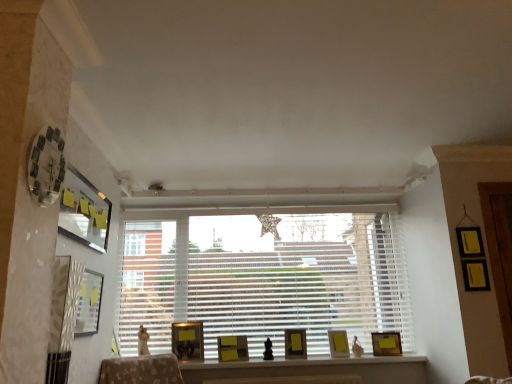
Question: Can we say matte wooden picture frame at center, which is counted as the 3th picture frame, starting from the left, lies outside matte yellow picture frame at center, placed as the 4th picture frame when sorted from front to back?

Choices:
 (A) yes
 (B) no

Answer: (A)

Question: Is matte wooden picture frame at center, arranged as the 3th picture frame when viewed from the front, at the left side of matte yellow picture frame at center, positioned as the fourth picture frame in left-to-right order?

Choices:
 (A) yes
 (B) no

Answer: (A)

Question: From the image's perspective, is matte wooden picture frame at center, arranged as the 3th picture frame when viewed from the front, on top of matte yellow picture frame at center, which is the fourth picture frame in back-to-front order?

Choices:
 (A) no
 (B) yes

Answer: (B)

Question: Does matte wooden picture frame at center, which is counted as the 5th picture frame, starting from the right, turn towards matte yellow picture frame at center, which is the fourth picture frame in back-to-front order?

Choices:
 (A) yes
 (B) no

Answer: (B)

Question: From a real-world perspective, is matte wooden picture frame at center, which is counted as the 3th picture frame, starting from the left, physically below matte yellow picture frame at center, positioned as the fourth picture frame in left-to-right order?

Choices:
 (A) yes
 (B) no

Answer: (B)

Question: Considering the positions of matte gold picture frame at center, the 3th picture frame when ordered from right to left, and matte wooden picture frame at center, which is counted as the 5th picture frame, starting from the right, in the image, is matte gold picture frame at center, the 3th picture frame when ordered from right to left, taller or shorter than matte wooden picture frame at center, which is counted as the 5th picture frame, starting from the right,?

Choices:
 (A) tall
 (B) short

Answer: (B)

Question: Looking at the image, does matte gold picture frame at center, the 3th picture frame when ordered from right to left, seem bigger or smaller compared to matte wooden picture frame at center, arranged as the 3th picture frame when viewed from the front?

Choices:
 (A) small
 (B) big

Answer: (A)

Question: Is matte gold picture frame at center, positioned as the 5th picture frame in left-to-right order, inside the boundaries of matte wooden picture frame at center, which is counted as the 3th picture frame, starting from the left, or outside?

Choices:
 (A) inside
 (B) outside

Answer: (B)

Question: From a real-world perspective, relative to matte wooden picture frame at center, which is counted as the 5th picture frame, starting from the right, is matte gold picture frame at center, which is counted as the third picture frame, starting from the back, vertically above or below?

Choices:
 (A) above
 (B) below

Answer: (B)

Question: From a real-world perspective, is white blinds at center above or below matte yellow picture frame at center, the 6th picture frame from the front?

Choices:
 (A) above
 (B) below

Answer: (A)

Question: Relative to matte yellow picture frame at center, positioned as the second picture frame in back-to-front order, is white blinds at center in front or behind?

Choices:
 (A) front
 (B) behind

Answer: (B)

Question: From the image's perspective, relative to matte yellow picture frame at center, the sixth picture frame in the left-to-right sequence, is white blinds at center above or below?

Choices:
 (A) below
 (B) above

Answer: (B)

Question: Is white blinds at center to the left or to the right of matte yellow picture frame at center, the 6th picture frame from the front, in the image?

Choices:
 (A) left
 (B) right

Answer: (A)

Question: Would you say matte yellow picture frame at center, which is the fourth picture frame from right to left, is to the left or to the right of matte black picture frame at upper left, which ranks as the first picture frame in left-to-right order, in the picture?

Choices:
 (A) left
 (B) right

Answer: (B)

Question: In terms of width, does matte yellow picture frame at center, placed as the 4th picture frame when sorted from front to back, look wider or thinner when compared to matte black picture frame at upper left, which ranks as the second picture frame in front-to-back order?

Choices:
 (A) thin
 (B) wide

Answer: (B)